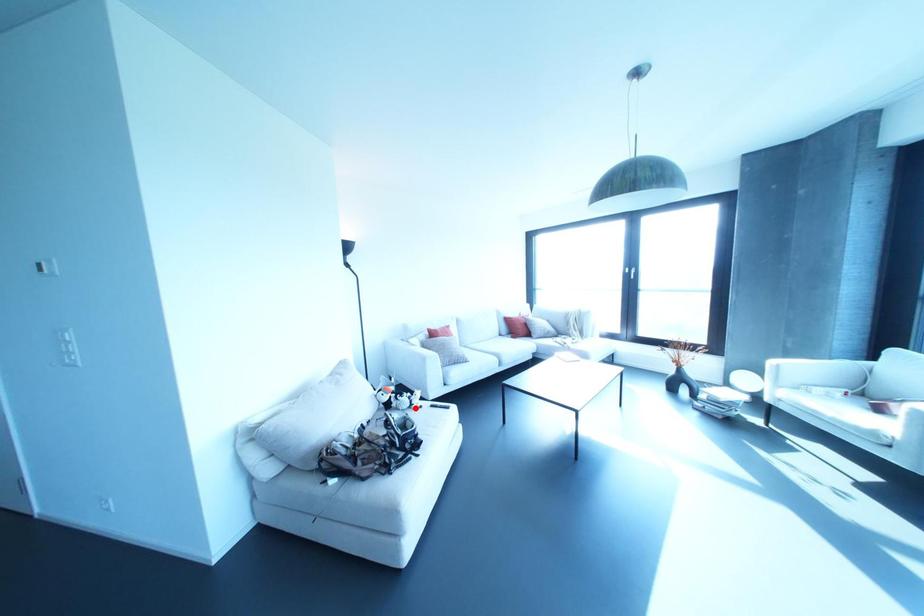
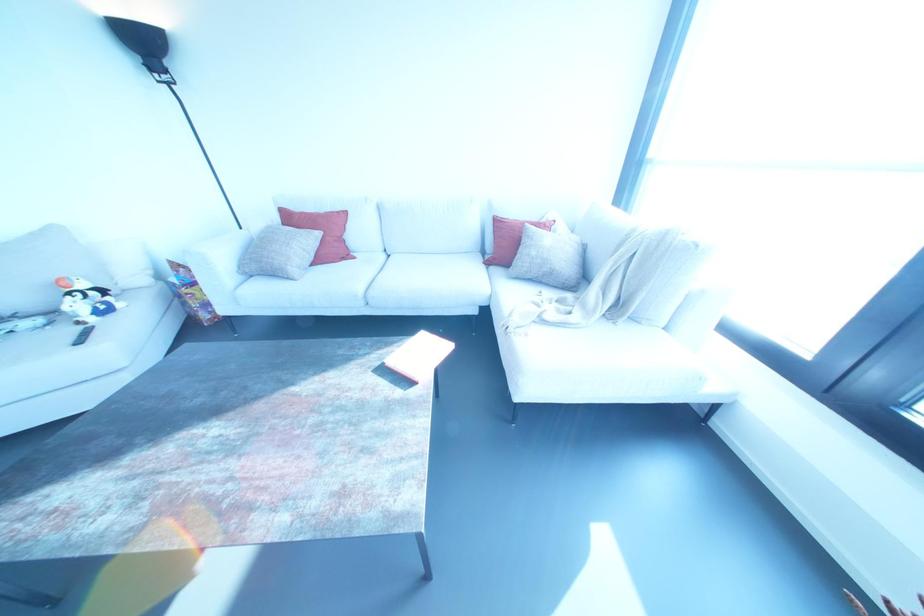
Locate, in the second image, the point that corresponds to the highlighted location in the first image.

(78, 322)